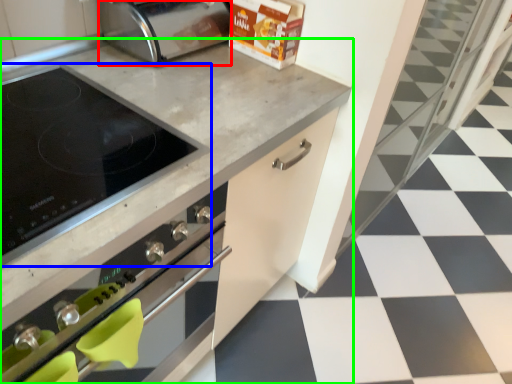
Question: Based on their relative distances, which object is nearer to toaster (highlighted by a red box)? Choose from kitchen appliance (highlighted by a blue box) and countertop (highlighted by a green box).

Choices:
 (A) kitchen appliance
 (B) countertop

Answer: (B)